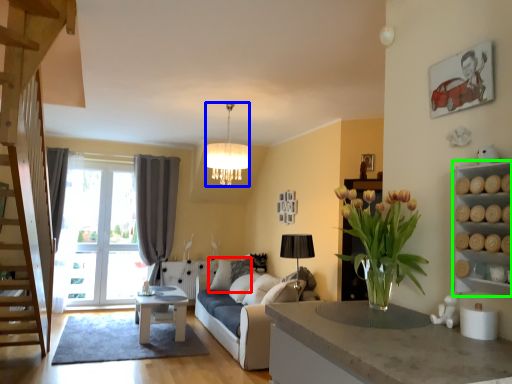
Question: Which object is the closest to the pillow (highlighted by a red box)? Choose among these: lamp (highlighted by a blue box) or cabinet (highlighted by a green box).

Choices:
 (A) lamp
 (B) cabinet

Answer: (A)